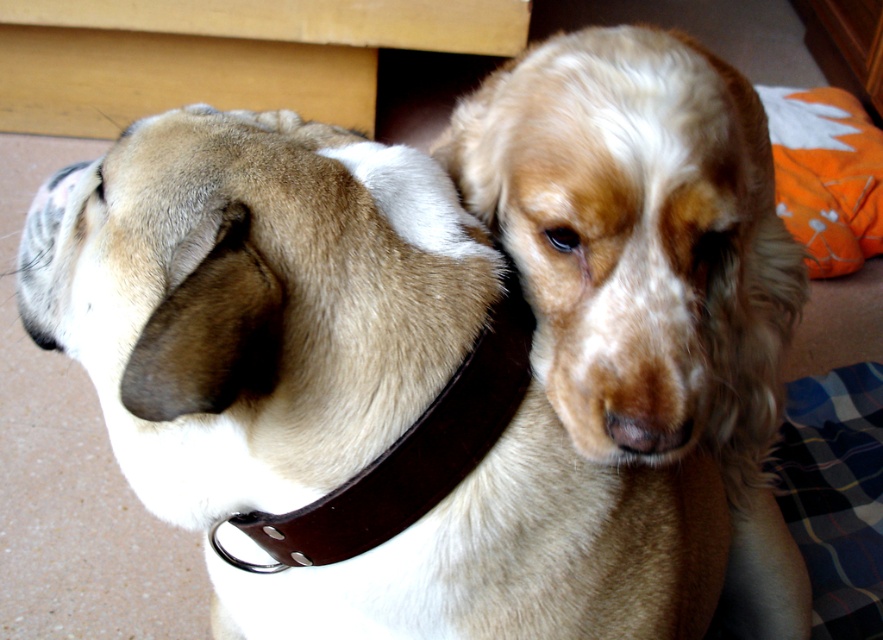
Question: Which of the following is the farthest from the observer?

Choices:
 (A) click(x=205, y=484)
 (B) click(x=371, y=483)
 (C) click(x=549, y=323)

Answer: (C)

Question: Can you confirm if golden fur dog at center is positioned below brown leather neckband at left?

Choices:
 (A) yes
 (B) no

Answer: (B)

Question: Can you confirm if brown leather collar at upper center is smaller than golden fur dog at center?

Choices:
 (A) no
 (B) yes

Answer: (A)

Question: Among these points, which one is nearest to the camera?

Choices:
 (A) (340, 625)
 (B) (382, 483)
 (C) (609, 452)

Answer: (B)

Question: Can you confirm if brown leather collar at upper center is positioned below brown leather neckband at left?

Choices:
 (A) yes
 (B) no

Answer: (A)

Question: Among these points, which one is nearest to the camera?

Choices:
 (A) [464, 458]
 (B) [585, 64]
 (C) [285, 589]

Answer: (A)